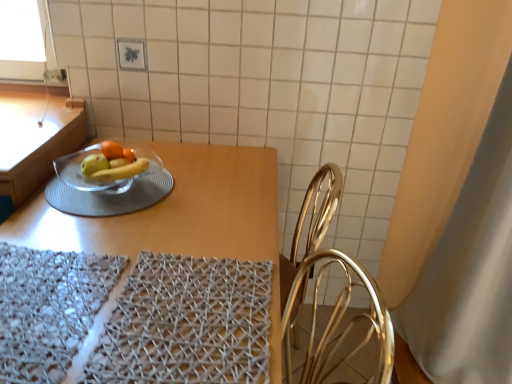
Where is `free space in front of transparent glass bowl at center`? The height and width of the screenshot is (384, 512). free space in front of transparent glass bowl at center is located at coordinates (103, 241).